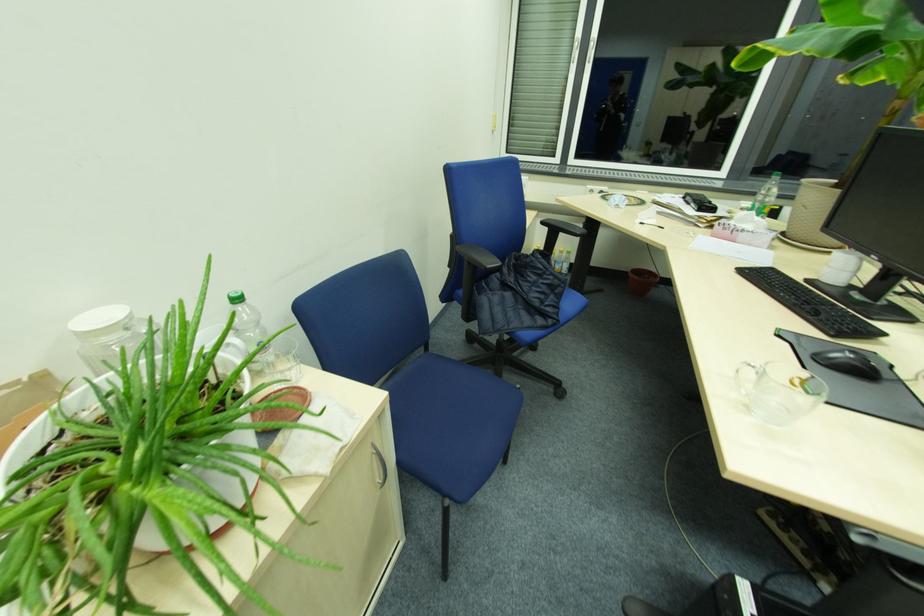
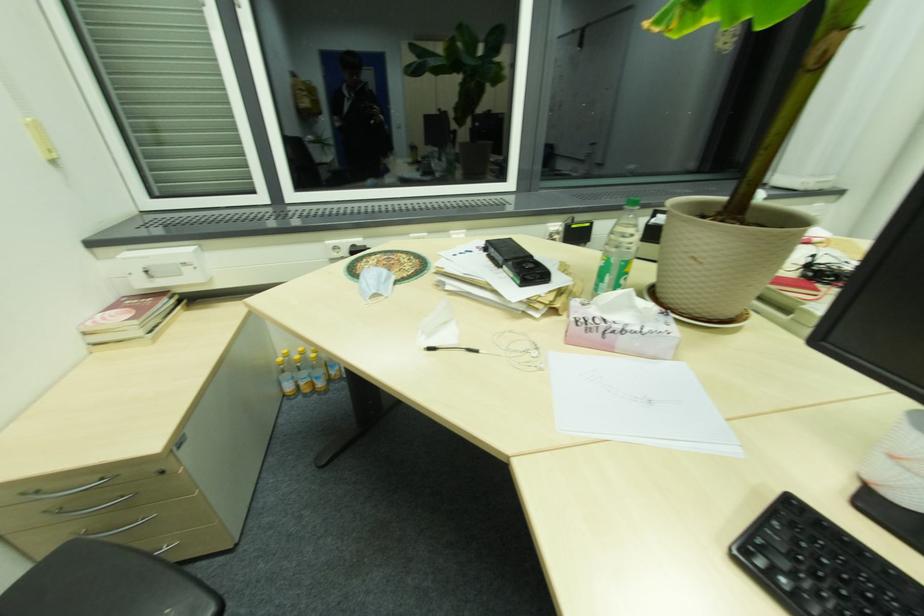
In the second image, find the point that corresponds to (x=695, y=205) in the first image.

(504, 268)